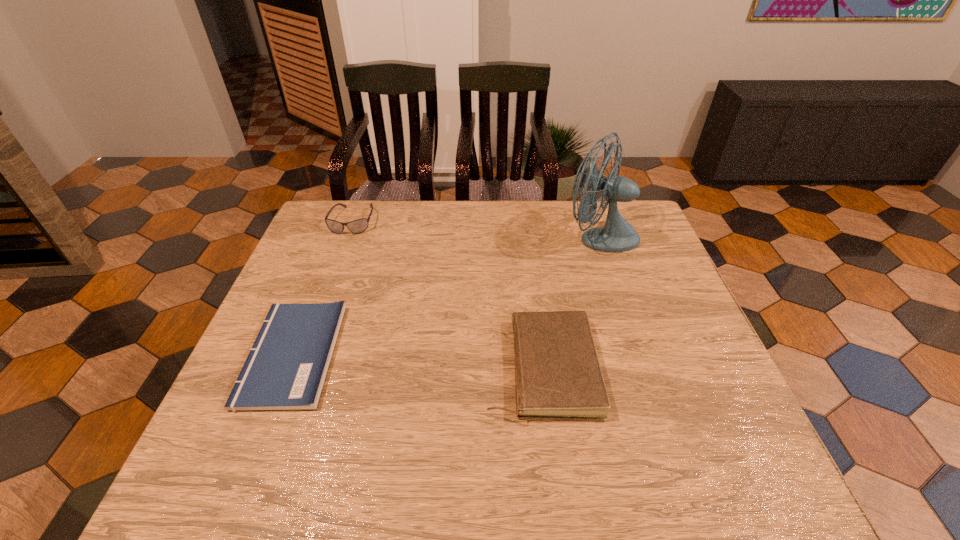
Locate an element on the screen. The image size is (960, 540). free space between the sunglasses and the fan is located at coordinates (476, 228).

Locate an element on the screen. The height and width of the screenshot is (540, 960). free area in between the left paperback book and the sunglasses is located at coordinates (323, 288).

Locate an element on the screen. The height and width of the screenshot is (540, 960). free area in between the tallest object and the shortest object is located at coordinates (446, 295).

Where is `empty space that is in between the taller paperback book and the fan`? empty space that is in between the taller paperback book and the fan is located at coordinates (570, 302).

I want to click on empty location between the sunglasses and the right paperback book, so click(x=447, y=294).

Image resolution: width=960 pixels, height=540 pixels. I want to click on empty space between the taller paperback book and the tallest object, so click(x=570, y=302).

You are a GUI agent. You are given a task and a screenshot of the screen. Output one action in this format:
    pyautogui.click(x=<x>, y=<y>)
    Task: Click on the object identified as the second closest to the fan
    Image resolution: width=960 pixels, height=540 pixels.
    Given the screenshot: What is the action you would take?
    pyautogui.click(x=358, y=226)

Where is `object that stands as the closest to the taller paperback book`? The image size is (960, 540). object that stands as the closest to the taller paperback book is located at coordinates (617, 235).